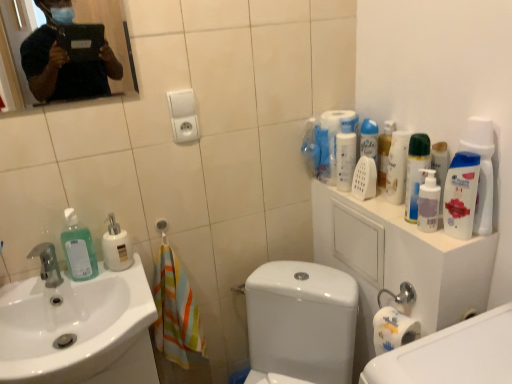
Question: From the image's perspective, is white glossy sink at lower left beneath green matte soap dispenser at left, the first cleaning product in the left-to-right sequence?

Choices:
 (A) yes
 (B) no

Answer: (A)

Question: Is white glossy sink at lower left turned away from green matte soap dispenser at left, acting as the 6th cleaning product starting from the right?

Choices:
 (A) no
 (B) yes

Answer: (A)

Question: Is white glossy sink at lower left thinner than green matte soap dispenser at left, the first cleaning product in the left-to-right sequence?

Choices:
 (A) yes
 (B) no

Answer: (B)

Question: From the image's perspective, is white glossy sink at lower left over green matte soap dispenser at left, acting as the 6th cleaning product starting from the right?

Choices:
 (A) yes
 (B) no

Answer: (B)

Question: Does white glossy sink at lower left have a smaller size compared to green matte soap dispenser at left, acting as the 6th cleaning product starting from the right?

Choices:
 (A) yes
 (B) no

Answer: (B)

Question: Is matte black tablet at upper left bigger or smaller than white glossy soap dispenser at left, arranged as the second cleaning product when viewed from the left?

Choices:
 (A) small
 (B) big

Answer: (A)

Question: In terms of height, does matte black tablet at upper left look taller or shorter compared to white glossy soap dispenser at left, arranged as the second cleaning product when viewed from the left?

Choices:
 (A) short
 (B) tall

Answer: (B)

Question: Relative to white glossy soap dispenser at left, which is the fifth cleaning product from right to left, is matte black tablet at upper left in front or behind?

Choices:
 (A) behind
 (B) front

Answer: (B)

Question: From a real-world perspective, is matte black tablet at upper left physically located above or below white glossy soap dispenser at left, which is the fifth cleaning product from right to left?

Choices:
 (A) below
 (B) above

Answer: (B)

Question: Considering the positions of green matte spray can at upper right, which is counted as the second cleaning product, starting from the right, and white glossy sink at lower left in the image, is green matte spray can at upper right, which is counted as the second cleaning product, starting from the right, wider or thinner than white glossy sink at lower left?

Choices:
 (A) wide
 (B) thin

Answer: (B)

Question: Is green matte spray can at upper right, which is the fifth cleaning product in left-to-right order, taller or shorter than white glossy sink at lower left?

Choices:
 (A) short
 (B) tall

Answer: (B)

Question: From a real-world perspective, relative to white glossy sink at lower left, is green matte spray can at upper right, which is counted as the second cleaning product, starting from the right, vertically above or below?

Choices:
 (A) below
 (B) above

Answer: (B)

Question: Is green matte spray can at upper right, which is counted as the second cleaning product, starting from the right, bigger or smaller than white glossy sink at lower left?

Choices:
 (A) small
 (B) big

Answer: (A)

Question: From the image's perspective, relative to translucent plastic mouthwash at upper right, acting as the 1th mouthwash starting from the back, is matte black tablet at upper left above or below?

Choices:
 (A) above
 (B) below

Answer: (A)

Question: Based on their sizes in the image, would you say matte black tablet at upper left is bigger or smaller than translucent plastic mouthwash at upper right, the first mouthwash viewed from the left?

Choices:
 (A) big
 (B) small

Answer: (A)